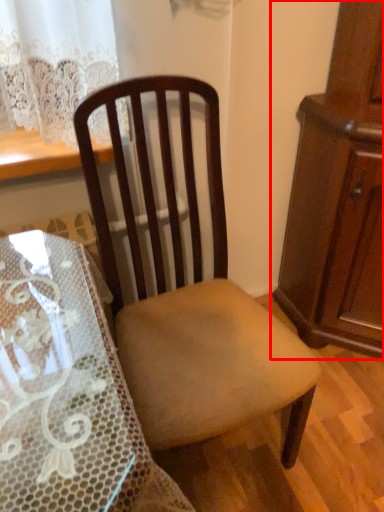
Question: From the image's perspective, what is the correct spatial relationship of cabinetry (annotated by the red box) in relation to chair?

Choices:
 (A) below
 (B) above

Answer: (B)